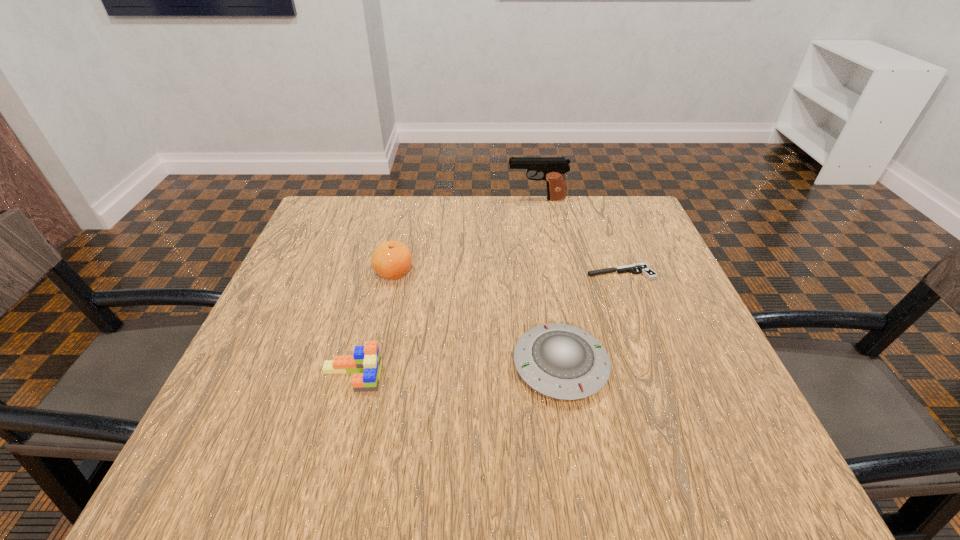
Identify the location of vacant space at the left edge of the desktop. (285, 323).

Image resolution: width=960 pixels, height=540 pixels. In order to click on free location at the right edge in this screenshot , I will do `click(669, 389)`.

Identify the location of vacant area at the far left corner. The image size is (960, 540). (302, 238).

The width and height of the screenshot is (960, 540). In order to click on vacant space at the near left corner of the desktop in this screenshot , I will do `click(208, 459)`.

I want to click on vacant space at the far right corner, so click(x=637, y=208).

In order to click on free space at the near right corner of the desktop in this screenshot , I will do `click(714, 438)`.

I want to click on free spot between the Lego and the left pistol, so click(444, 288).

Find the location of `free spot between the fourth tallest object and the clementine`. free spot between the fourth tallest object and the clementine is located at coordinates (477, 319).

Identify the location of empty space between the clementine and the taller pistol. (466, 235).

Locate an element on the screen. The width and height of the screenshot is (960, 540). empty location between the second shortest object and the clementine is located at coordinates (477, 319).